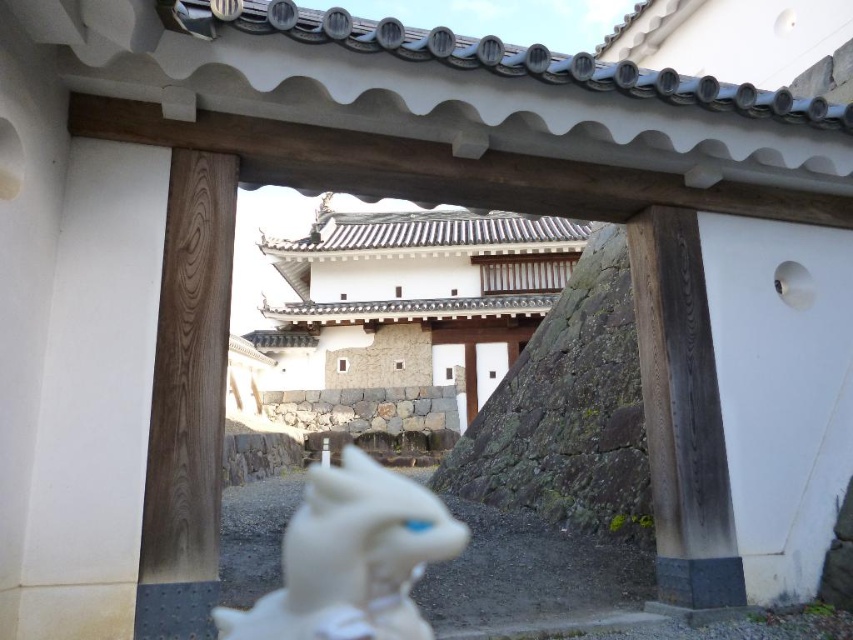
You are standing at the entrance of the courtyard and see the point marked as point (351,557). What object is located at that point?

The white glossy statue at center is located at point (351,557).

You are a visitor standing at the entrance of the courtyard. You see the white glossy statue at center and the stone wall at center. Which object is narrower in width?

The white glossy statue at center is narrower in width than the stone wall at center.

You are standing in front of a traditional Japanese gate and see the white glossy statue at center and the stone wall at center. Which object is positioned higher from the ground?

The white glossy statue at center is above the stone wall at center, so it is positioned higher from the ground.